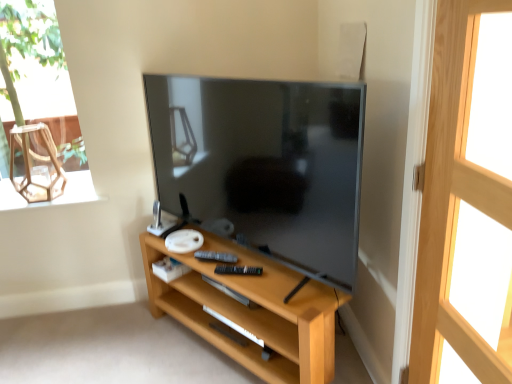
Where is `vacant space in transparent glass armchair at upper left (from a real-world perspective)`? This screenshot has width=512, height=384. vacant space in transparent glass armchair at upper left (from a real-world perspective) is located at coordinates (46, 198).